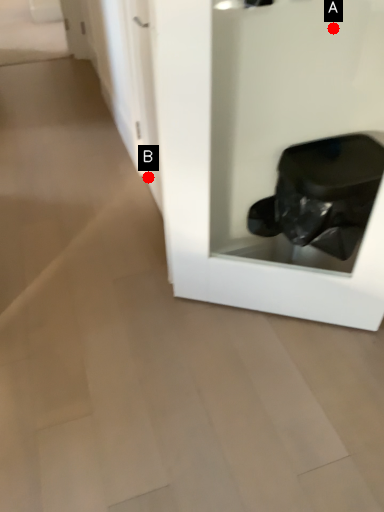
Question: Two points are circled on the image, labeled by A and B beside each circle. Which point is farther from the camera taking this photo?

Choices:
 (A) A is further
 (B) B is further

Answer: (B)